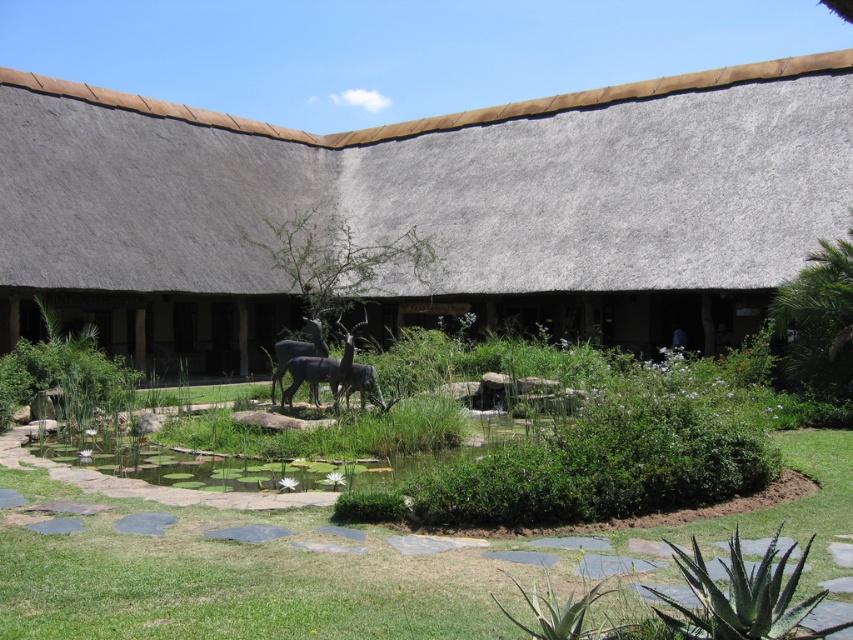
You are standing at the edge of the garden near the pond. You want to place a 10 feet wide statue between the thatched roof hut at center and the pond. Is there enough space between them to place the statue?

The distance between the thatched roof hut at center and the pond is 69.85 feet. Since the statue is 10 feet wide, there is sufficient space to place it between them.

You are planning to place a new decorative item in the garden. You have two statues available, the gray stone statue at center and the polished bronze statue at center. Based on their widths, which statue would require more space between them and other garden elements?

The gray stone statue at center might be wider than polished bronze statue at center, so it would require more space between them and other garden elements.

You are a visitor standing in the garden and want to take a photo of the thatched roof hut at center and the green leafy pond at center. If you want to include both in the frame, which object should you focus on to ensure both are visible?

To include both the thatched roof hut at center and the green leafy pond at center in the frame, focus on the thatched roof hut at center since it is taller than the green leafy pond at center, allowing the pond to be captured in the foreground.